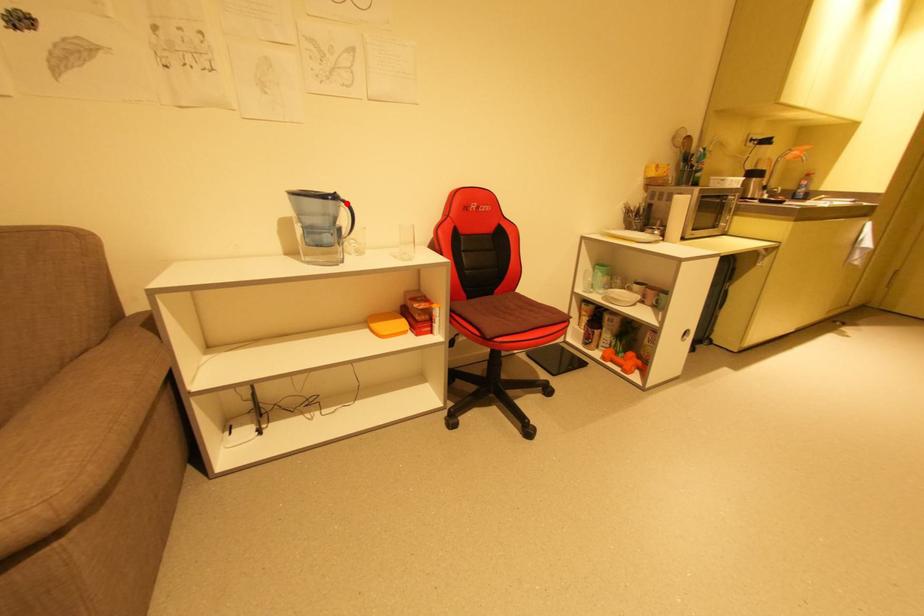
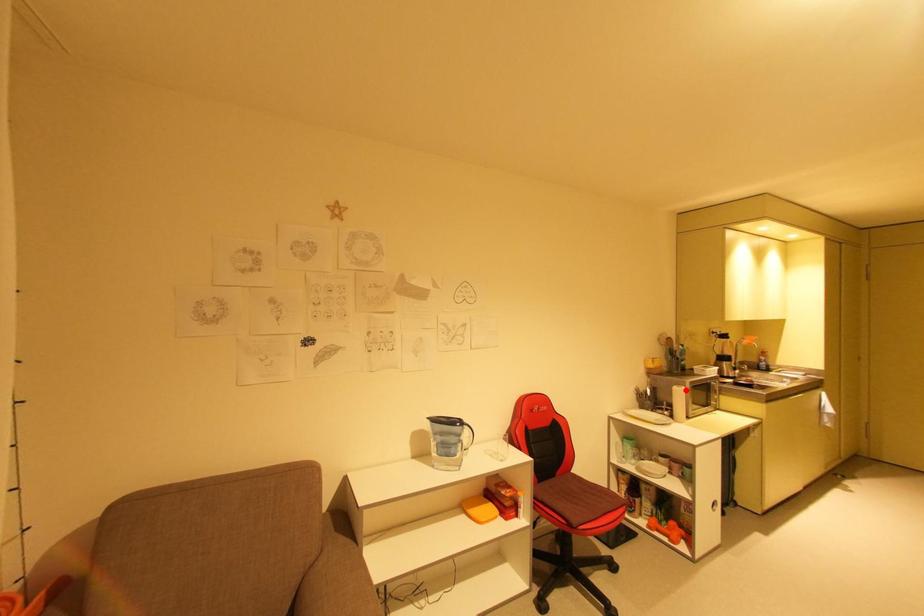
I am providing you with two images of the same scene from different viewpoints. A red point is marked on the first image and another point is marked on the second image. Are the points marked in image1 and image2 representing the same 3D position?

No